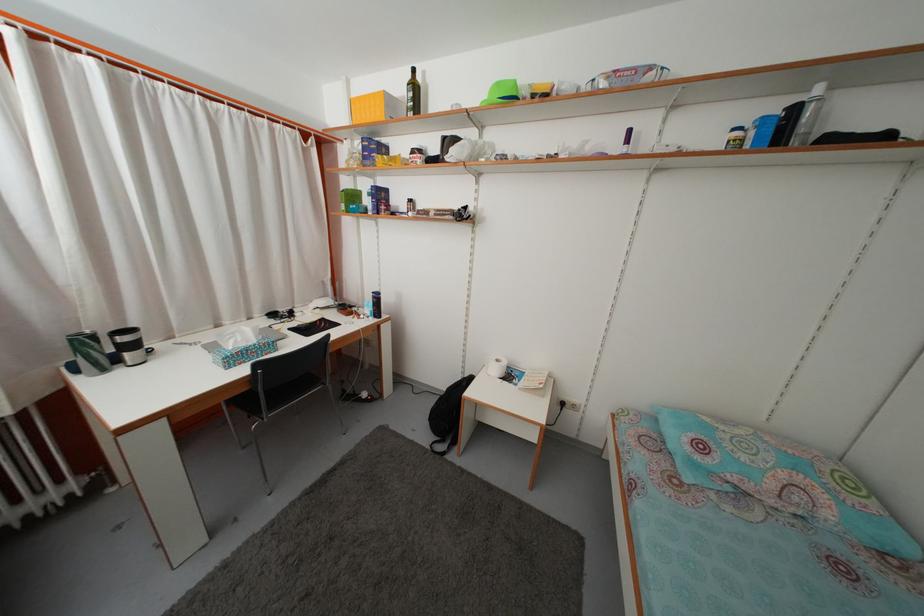
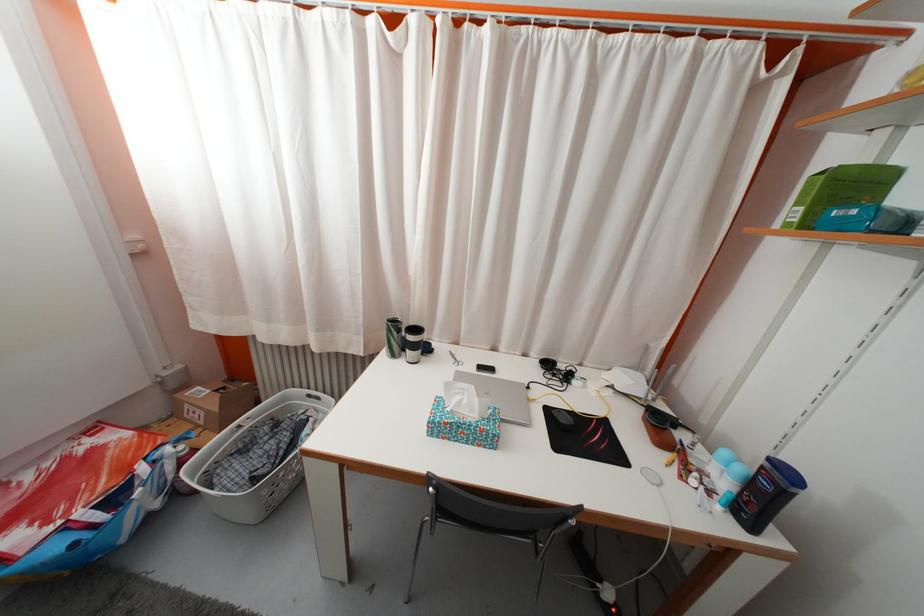
Question: The camera is either moving clockwise (left) or counter-clockwise (right) around the object. The first image is from the beginning of the video and the second image is from the end. Is the camera moving left or right when shooting the video?

Choices:
 (A) Left
 (B) Right

Answer: (B)